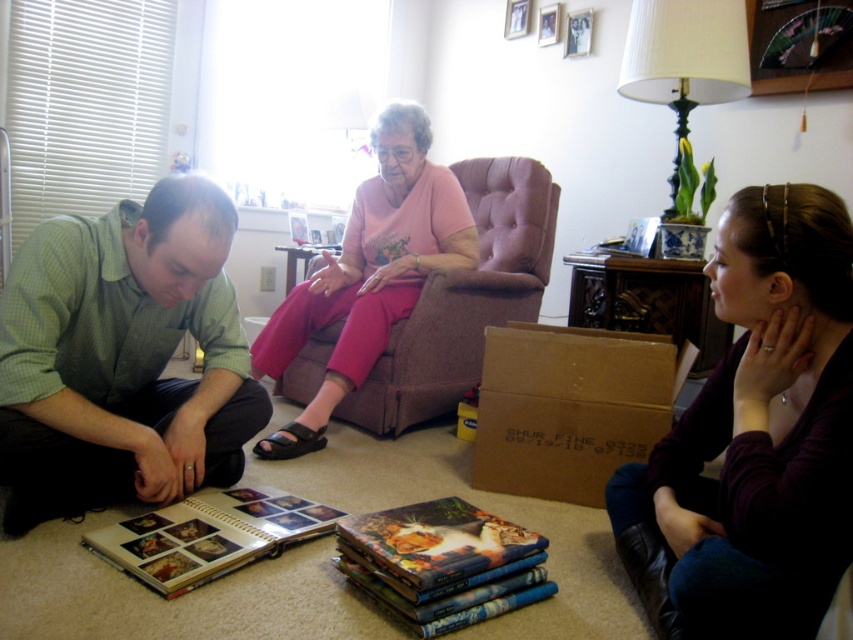
Is green checkered shirt at lower left wider than matte paper photo album at lower left?

Yes.

Who is higher up, green checkered shirt at lower left or matte paper photo album at lower left?

Positioned higher is green checkered shirt at lower left.

The height and width of the screenshot is (640, 853). Identify the location of green checkered shirt at lower left. (122, 356).

Is brown cardboard box at lower center taller than matte paper photo album at lower left?

Indeed, brown cardboard box at lower center has a greater height compared to matte paper photo album at lower left.

Does brown cardboard box at lower center have a larger size compared to matte paper photo album at lower left?

Yes, brown cardboard box at lower center is bigger than matte paper photo album at lower left.

Is point (664, 371) positioned before point (184, 556)?

That is False.

This screenshot has width=853, height=640. Find the location of `brown cardboard box at lower center`. brown cardboard box at lower center is located at coordinates (567, 408).

Who is higher up, maroon sweater at lower right or green checkered shirt at lower left?

Positioned higher is green checkered shirt at lower left.

Image resolution: width=853 pixels, height=640 pixels. What do you see at coordinates (761, 429) in the screenshot? I see `maroon sweater at lower right` at bounding box center [761, 429].

Who is more forward, (741, 556) or (74, 358)?

Point (741, 556) is in front.

This screenshot has width=853, height=640. I want to click on maroon sweater at lower right, so click(761, 429).